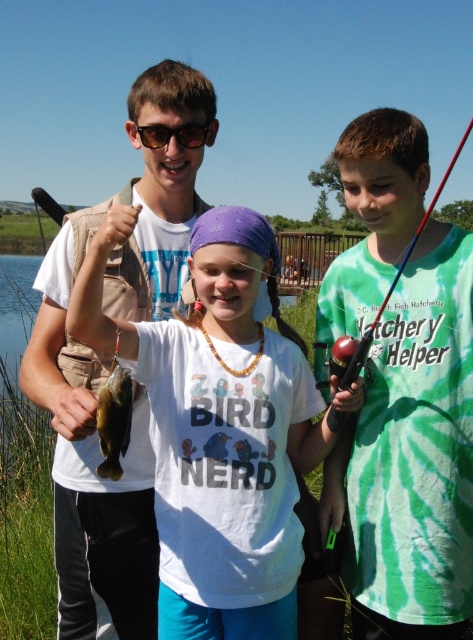
Question: Which point is closer to the camera taking this photo?

Choices:
 (A) (148, 124)
 (B) (114, 412)

Answer: (B)

Question: Among these objects, which one is farthest from the camera?

Choices:
 (A) green tie-dye shirt at center
 (B) matte brown vest at upper left
 (C) shiny green fish at center
 (D) black plastic sunglasses at upper center

Answer: (D)

Question: Which object is farther from the camera taking this photo?

Choices:
 (A) black plastic sunglasses at upper center
 (B) white matte shirt at center
 (C) shiny green fish at center

Answer: (A)

Question: Is white matte shirt at center above matte brown vest at upper left?

Choices:
 (A) no
 (B) yes

Answer: (A)

Question: Does shiny green fish at center appear under black plastic sunglasses at upper center?

Choices:
 (A) yes
 (B) no

Answer: (A)

Question: Is matte brown vest at upper left below black plastic sunglasses at upper center?

Choices:
 (A) yes
 (B) no

Answer: (A)